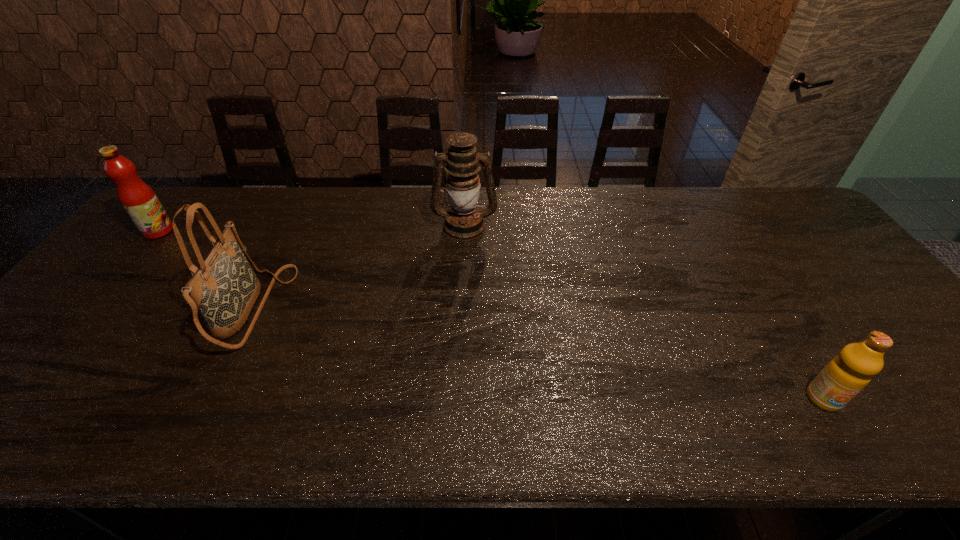
At what (x,y) coordinates should I click in order to perform the action: click on lantern positioned at the far edge. Please return your answer as a coordinate pair (x, y). The width and height of the screenshot is (960, 540). Looking at the image, I should click on (464, 221).

Where is `fruit juice situated at the far edge`? The width and height of the screenshot is (960, 540). fruit juice situated at the far edge is located at coordinates (138, 199).

Identify the location of object that is positioned at the near edge. This screenshot has width=960, height=540. (847, 374).

Where is `object that is at the left edge`? object that is at the left edge is located at coordinates (138, 199).

Image resolution: width=960 pixels, height=540 pixels. In order to click on object present at the far left corner in this screenshot , I will do `click(138, 199)`.

This screenshot has height=540, width=960. In order to click on vacant space at the far edge of the desktop in this screenshot , I will do `click(242, 225)`.

Where is `free space at the near edge of the desktop`? This screenshot has height=540, width=960. free space at the near edge of the desktop is located at coordinates (342, 426).

This screenshot has height=540, width=960. In order to click on vacant space at the right edge of the desktop in this screenshot , I will do `click(821, 279)`.

Identify the location of free location at the far right corner of the desktop. The height and width of the screenshot is (540, 960). (782, 217).

Find the location of a particular element. Image resolution: width=960 pixels, height=540 pixels. unoccupied position between the right fruit juice and the handbag is located at coordinates (538, 354).